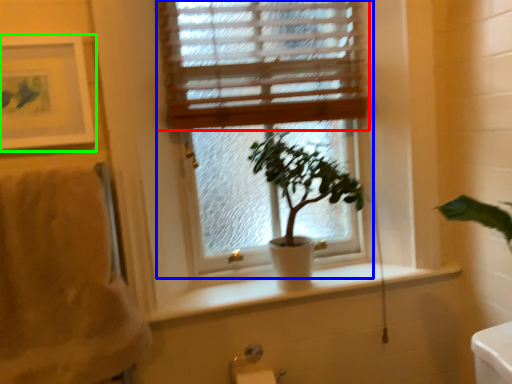
Question: Estimate the real-world distances between objects in this image. Which object is closer to window blind (highlighted by a red box), window (highlighted by a blue box) or picture frame (highlighted by a green box)?

Choices:
 (A) window
 (B) picture frame

Answer: (A)